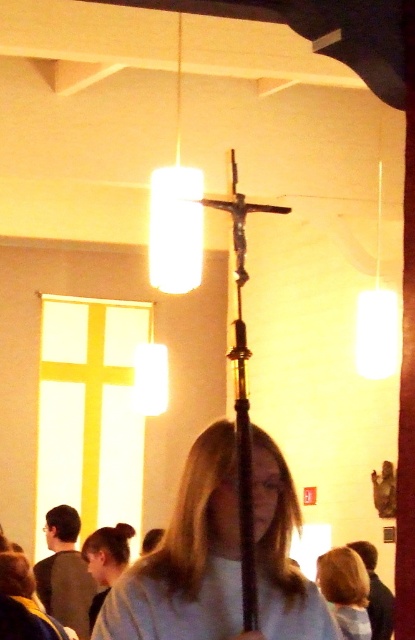
You are standing in the church and want to place a small flower pot at the position of point (276, 557) and another flower pot at point (75, 563). Which flower pot will appear larger in the image?

The flower pot at point (276, 557) will appear larger because it is closer to the camera than the flower pot at point (75, 563).